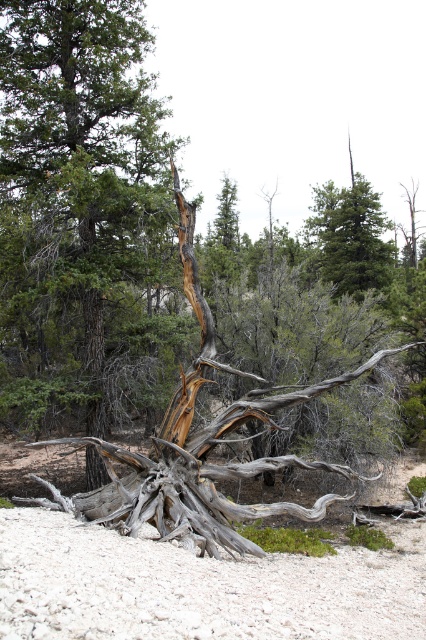
Between point (97, 120) and point (308, 564), which one is positioned in front?

Positioned in front is point (308, 564).

Describe the element at coordinates (80, 205) in the screenshot. I see `grayish-brown wood at center` at that location.

Locate an element on the screen. grayish-brown wood at center is located at coordinates (80, 205).